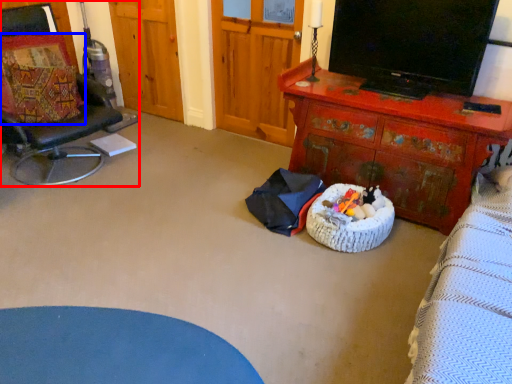
Question: Which object is further to the camera taking this photo, chair (highlighted by a red box) or pillow (highlighted by a blue box)?

Choices:
 (A) chair
 (B) pillow

Answer: (B)